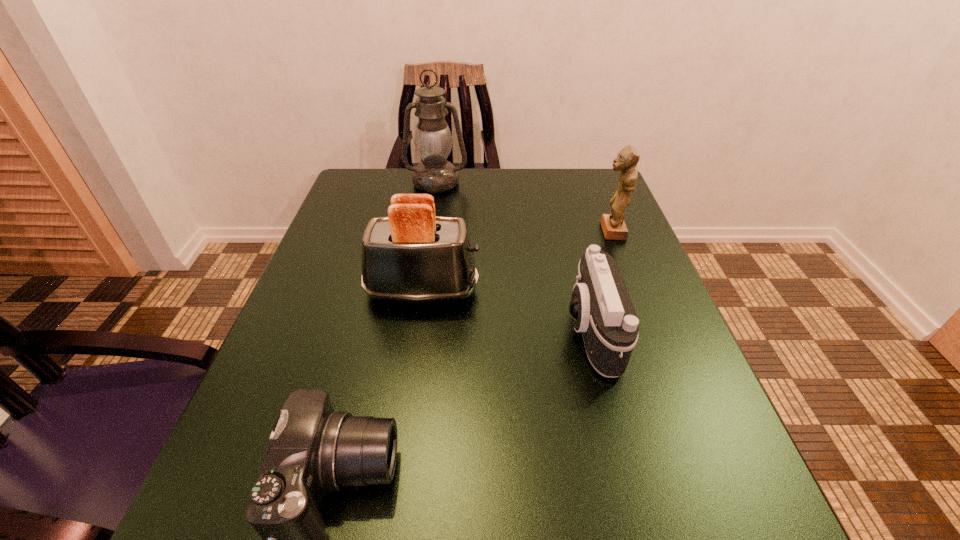
The width and height of the screenshot is (960, 540). I want to click on vacant space positioned on the front-facing side of the rightmost object, so click(508, 231).

The height and width of the screenshot is (540, 960). In order to click on vacant space located 0.190m on the side of the toaster with the control lever in this screenshot , I will do `click(575, 291)`.

Find the location of `vacant area situated 0.140m on the front lens of the fourth object from left to right`. vacant area situated 0.140m on the front lens of the fourth object from left to right is located at coordinates (487, 331).

This screenshot has width=960, height=540. In order to click on vacant area located on the front lens of the fourth object from left to right in this screenshot , I will do `click(381, 331)`.

I want to click on vacant space located 0.090m on the front lens of the fourth object from left to right, so click(515, 331).

Where is `object that is at the far edge`? This screenshot has height=540, width=960. object that is at the far edge is located at coordinates (432, 139).

This screenshot has width=960, height=540. What are the coordinates of `oil lamp positioned at the left edge` in the screenshot? It's located at (432, 139).

Where is `toaster located in the left edge section of the desktop`? This screenshot has width=960, height=540. toaster located in the left edge section of the desktop is located at coordinates (412, 255).

Locate an element on the screen. The width and height of the screenshot is (960, 540). figurine positioned at the right edge is located at coordinates (614, 228).

Locate an element on the screen. camera that is at the right edge is located at coordinates (601, 308).